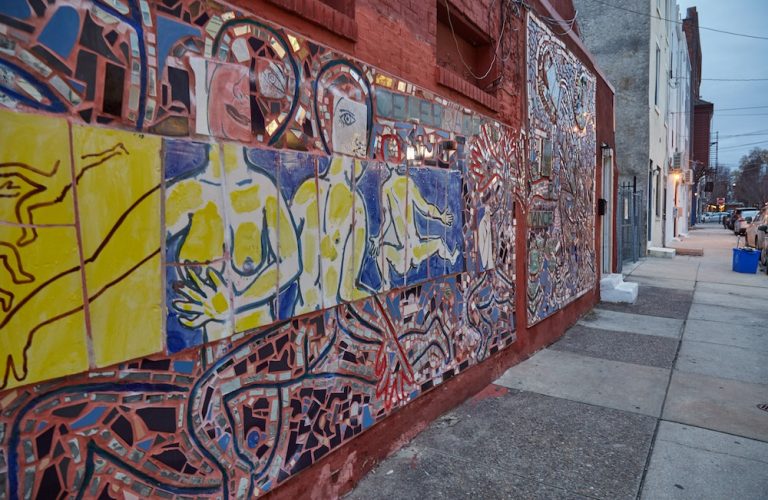
Locate an element on the screen. The height and width of the screenshot is (500, 768). light is located at coordinates (674, 175).